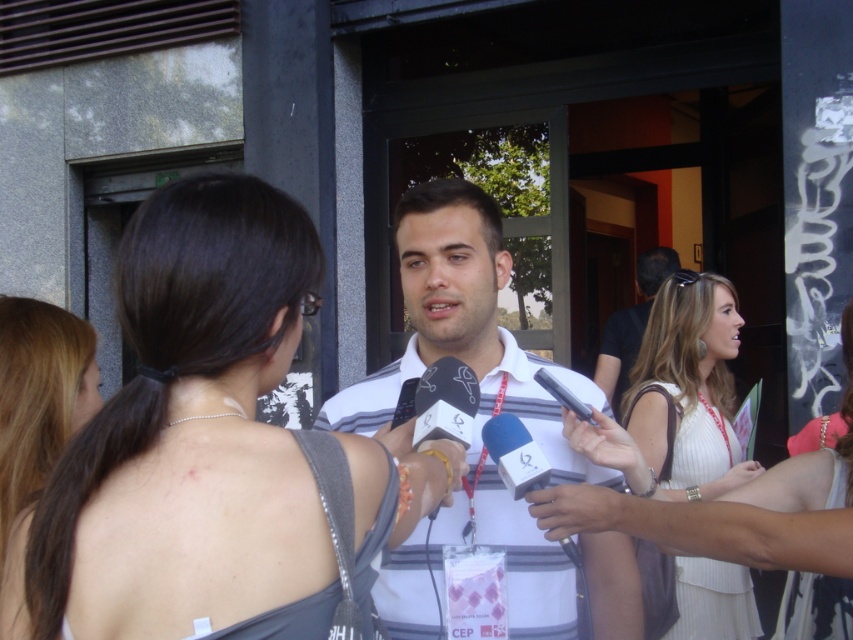
You are standing in front of the building where the interview is happening. There are two points marked in the scene, one at coordinates point (107, 444) and the other at point (607, 349). Which point is closer to you?

Point (107, 444) is closer to the viewer than point (607, 349).

You are a photographer trying to capture a clear shot of the man being interviewed. You notice the white striped shirt at center and the blonde hair at center. Which one should you focus on first to ensure it appears sharper in the photo?

The white striped shirt at center is further to the viewer than the blonde hair at center, so focusing on the white striped shirt at center first will ensure it appears sharper since it is closer to the camera.

You are a photographer standing at the camera position. You need to take a photo of the man in the striped polo shirt. The focus distance of your camera is set to 2 meters. Will the photo be in focus if you focus on the point at coordinates point (573, 624)?

The distance between point (573, 624) and the camera is 1.94 meters. Since the focus distance is set to 2 meters, the photo will not be in focus because the actual distance is slightly less than the focus setting.